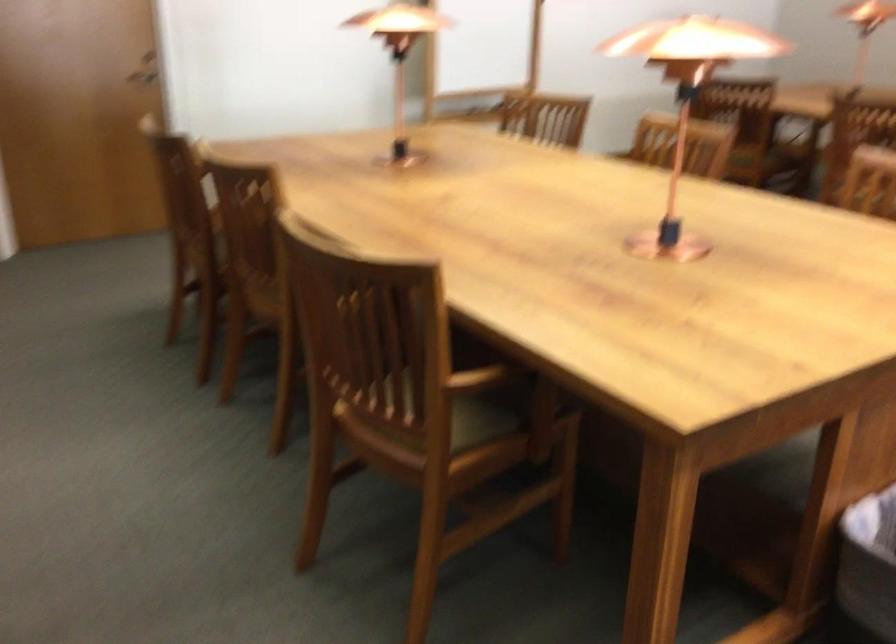
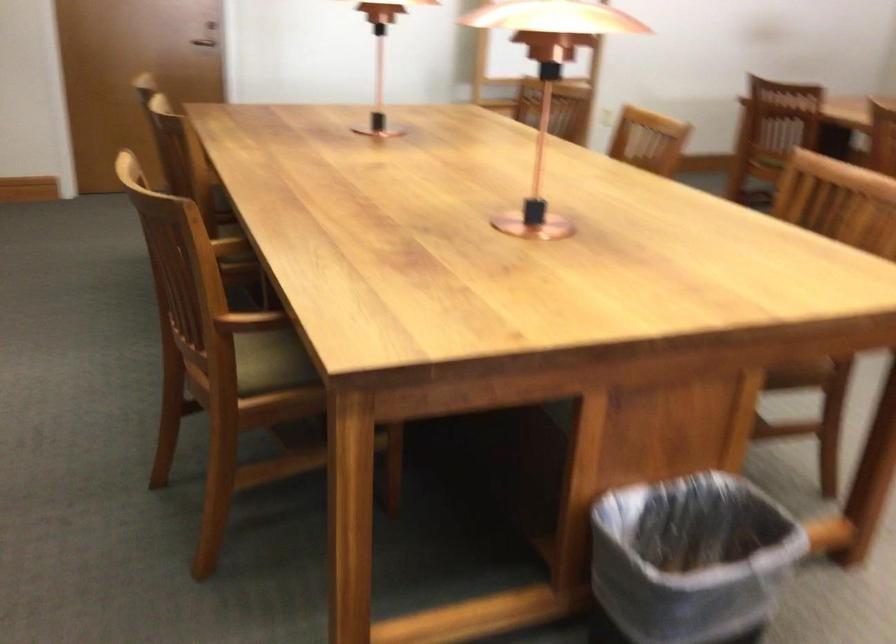
Locate, in the second image, the point that corresponds to [460,417] in the first image.

(271, 362)